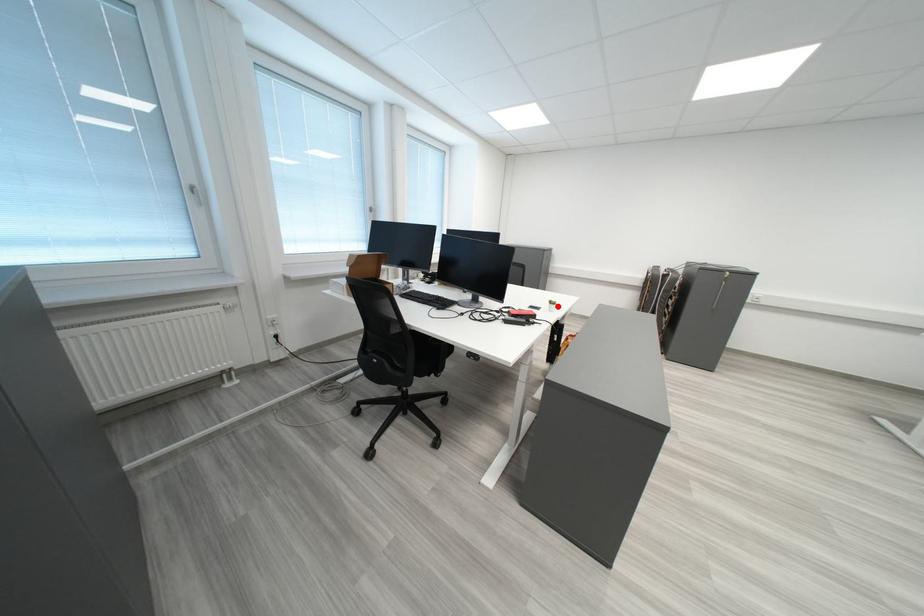
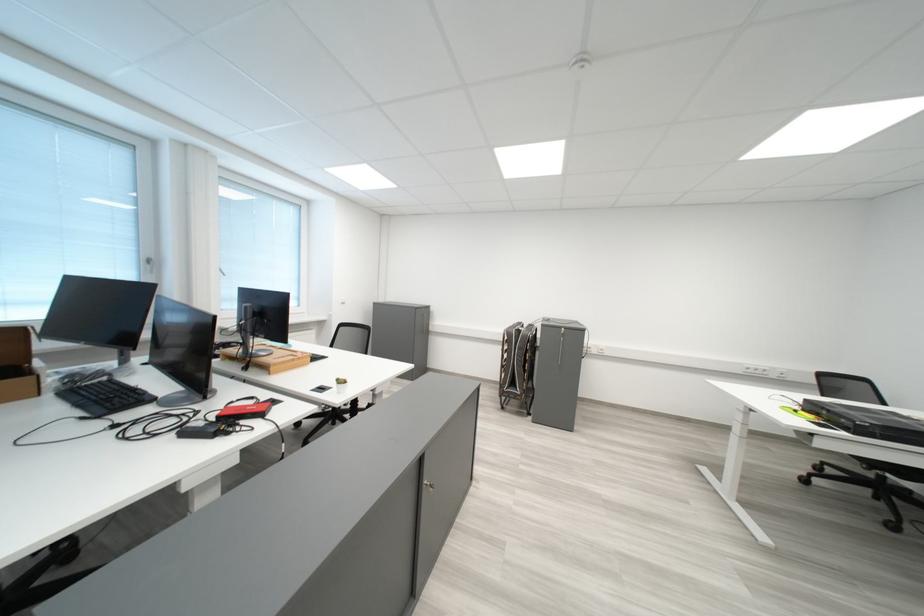
Locate, in the second image, the point that corresponds to the highlighted location in the first image.

(345, 386)